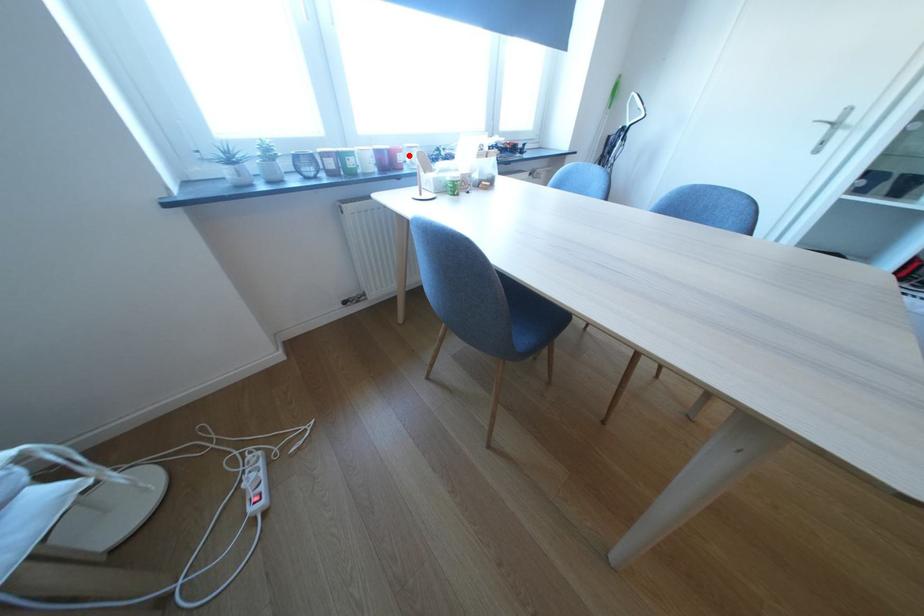
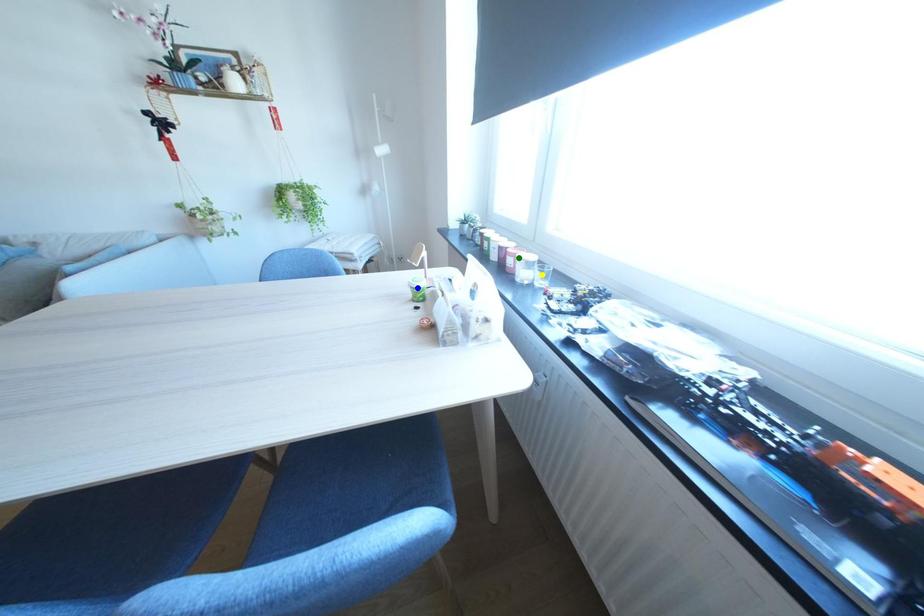
Question: I am providing you with two images of the same scene from different viewpoints. A red point is marked on the first image. You are given multiple points on the second image. Which point in image 2 represents the same 3d spot as the red point in image 1?

Choices:
 (A) green point
 (B) yellow point
 (C) blue point

Answer: (A)